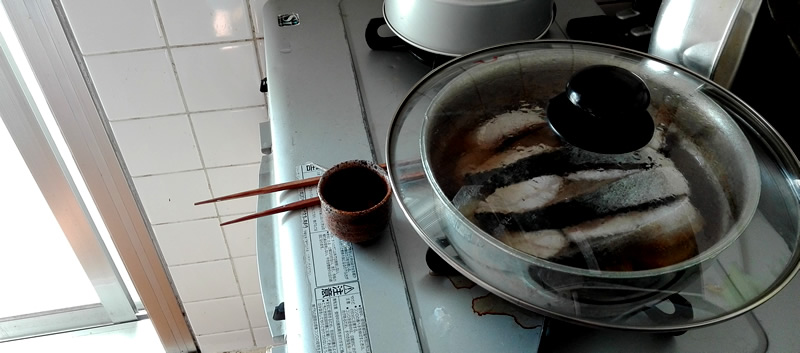
The width and height of the screenshot is (800, 353). I want to click on cup, so click(358, 218).